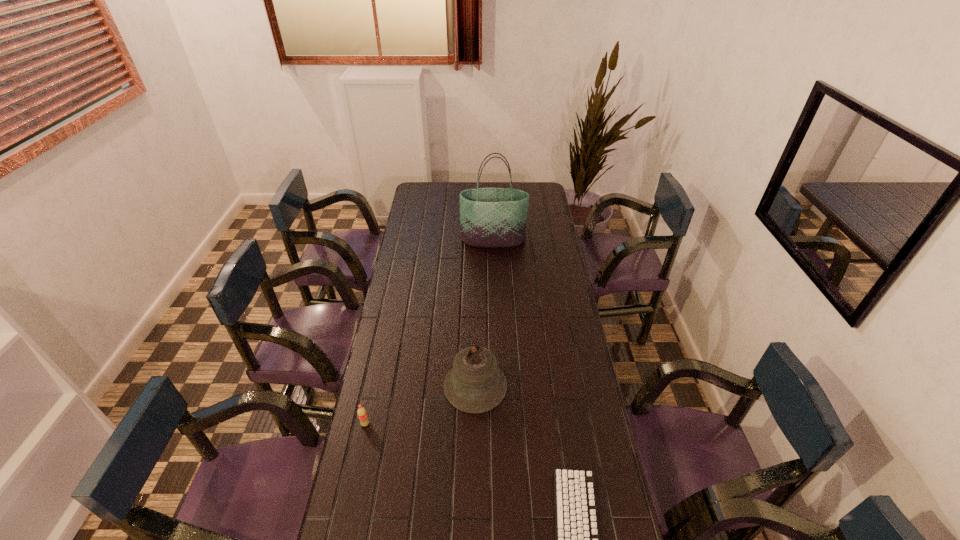
Identify the location of object situated at the right edge. The width and height of the screenshot is (960, 540). (489, 217).

Where is `free space at the far edge of the desktop`? This screenshot has height=540, width=960. free space at the far edge of the desktop is located at coordinates (515, 188).

Locate an element on the screen. Image resolution: width=960 pixels, height=540 pixels. free region at the left edge is located at coordinates (414, 248).

In the image, there is a desktop. Find the location of `free space at the right edge`. free space at the right edge is located at coordinates (584, 386).

Locate an element on the screen. Image resolution: width=960 pixels, height=540 pixels. free space at the far right corner is located at coordinates (545, 192).

Image resolution: width=960 pixels, height=540 pixels. What are the coordinates of `vacant region between the second shortest object and the second farthest object` in the screenshot? It's located at (420, 405).

Identify the location of vacant area that lies between the second farthest object and the second nearest object. This screenshot has height=540, width=960. (420, 405).

You are a GUI agent. You are given a task and a screenshot of the screen. Output one action in this format:
    pyautogui.click(x=<x>, y=<y>)
    Task: Click on the blank region between the tote bag and the leftmost object
    This screenshot has width=960, height=540.
    Given the screenshot: What is the action you would take?
    pyautogui.click(x=429, y=332)

Find the location of a particular element. free area in between the farthest object and the third farthest object is located at coordinates (429, 332).

I want to click on object that is the closest to the third nearest object, so [x=577, y=539].